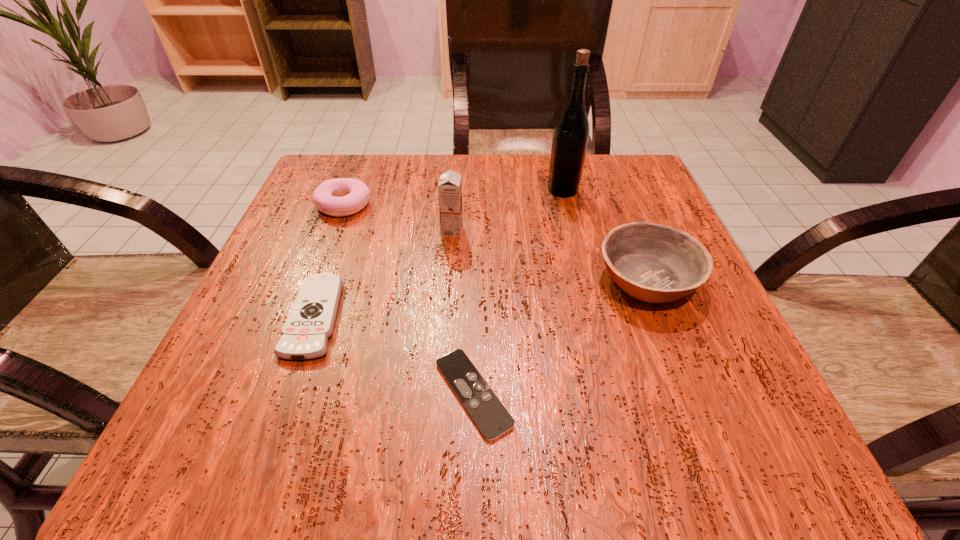
Locate an element on the screen. Image resolution: width=960 pixels, height=540 pixels. vacant space in between the fifth shortest object and the fourth tallest object is located at coordinates (398, 218).

At what (x,y) coordinates should I click in order to perform the action: click on unoccupied area between the beer bottle and the fourth shortest object. Please return your answer as a coordinate pair (x, y). Looking at the image, I should click on (605, 235).

Find the location of a particular element. The image size is (960, 540). vacant space that is in between the taller remote control and the third farthest object is located at coordinates (384, 274).

I want to click on vacant point located between the second shortest object and the third tallest object, so click(481, 298).

Locate an element on the screen. The image size is (960, 540). blank region between the chocolate milk and the beer bottle is located at coordinates (508, 211).

Identify the location of free spot between the fourth shortest object and the beer bottle. (605, 235).

At what (x,y) coordinates should I click in order to perform the action: click on unoccupied position between the taller remote control and the bowl. Please return your answer as a coordinate pair (x, y). Looking at the image, I should click on (481, 298).

This screenshot has height=540, width=960. I want to click on vacant point located between the fifth tallest object and the shorter remote control, so click(x=395, y=355).

The width and height of the screenshot is (960, 540). Find the location of `unoccupied position between the right remote control and the chocolate milk`. unoccupied position between the right remote control and the chocolate milk is located at coordinates (463, 312).

You are a GUI agent. You are given a task and a screenshot of the screen. Output one action in this format:
    pyautogui.click(x=<x>, y=<y>)
    Task: Click on the object that is the fifth closest to the third tallest object
    
    Given the screenshot: What is the action you would take?
    pyautogui.click(x=342, y=196)